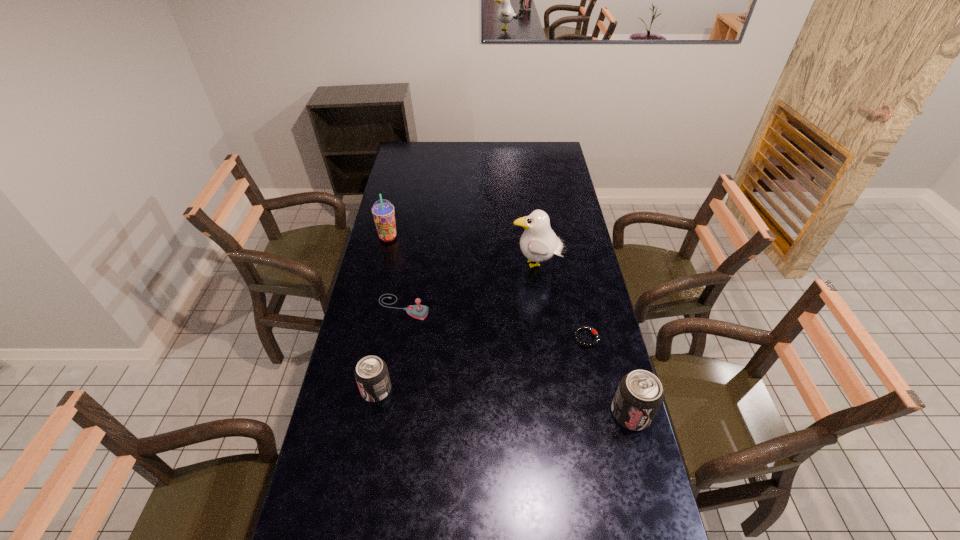
Identify which object is located as the nearest to the shortest object. Please provide its 2D coordinates. Your answer should be formatted as a tuple, i.e. [(x, y)], where the tuple contains the x and y coordinates of a point satisfying the conditions above.

[(640, 394)]

This screenshot has width=960, height=540. Identify the location of vacant point that satisfies the following two spatial constraints: 1. on the front side of the third farthest object; 2. on the right side of the fifth shortest object. (372, 307).

Where is `free space that satisfies the following two spatial constraints: 1. on the back side of the shorter soda can; 2. on the left side of the fourth farthest object`? This screenshot has height=540, width=960. free space that satisfies the following two spatial constraints: 1. on the back side of the shorter soda can; 2. on the left side of the fourth farthest object is located at coordinates (386, 338).

Identify the location of free location that satisfies the following two spatial constraints: 1. on the beak of the tallest object; 2. on the back side of the right soda can. Image resolution: width=960 pixels, height=540 pixels. (556, 414).

Locate an element on the screen. vacant position in the image that satisfies the following two spatial constraints: 1. on the front side of the second shortest object; 2. on the left side of the right soda can is located at coordinates (386, 414).